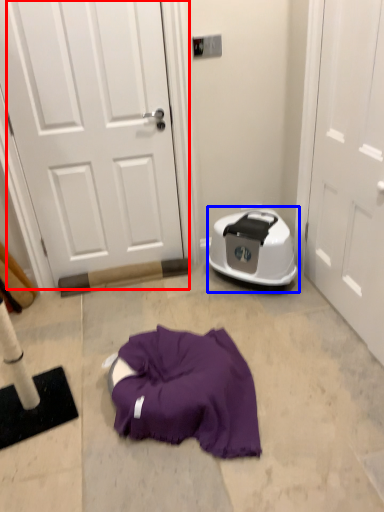
Question: Which object appears farthest to the camera in this image, door (highlighted by a red box) or dish washer (highlighted by a blue box)?

Choices:
 (A) door
 (B) dish washer

Answer: (B)